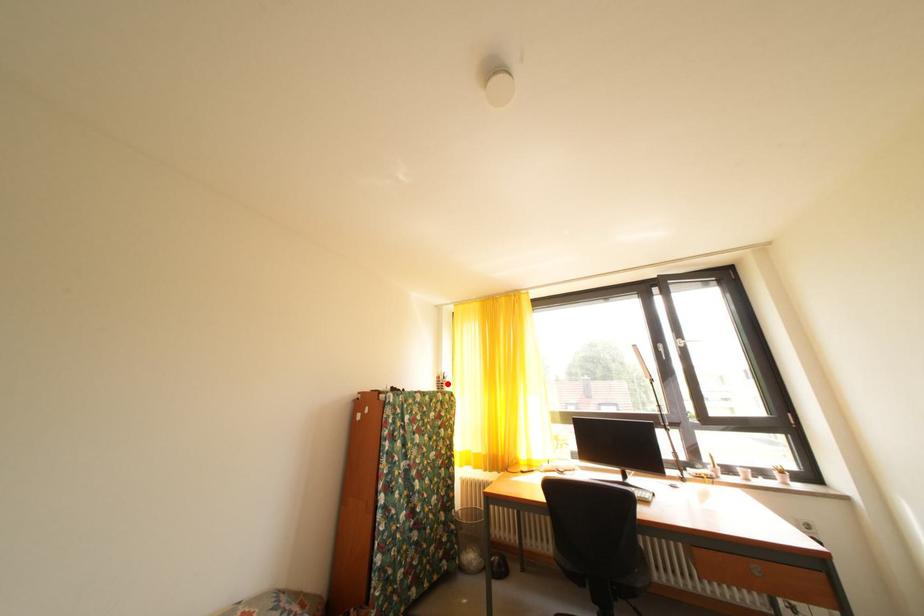
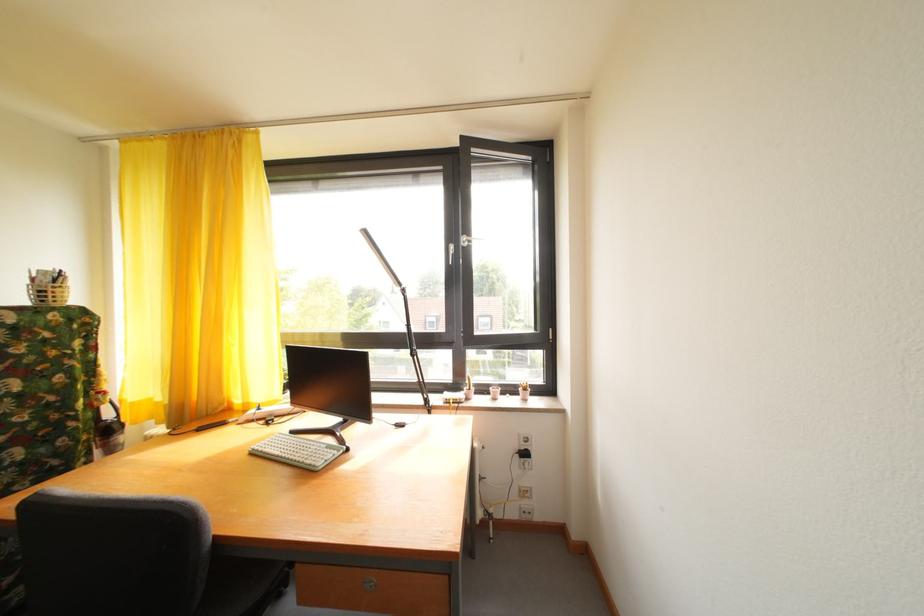
Where in the second image is the point corresponding to the highlighted location from the first image?

(43, 286)